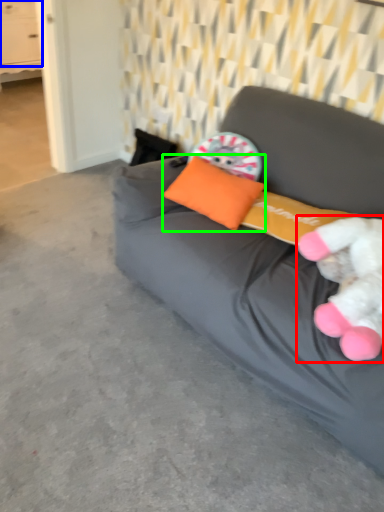
Question: Which is nearer to the toy (highlighted by a red box)? drawer (highlighted by a blue box) or pillow (highlighted by a green box).

Choices:
 (A) drawer
 (B) pillow

Answer: (B)